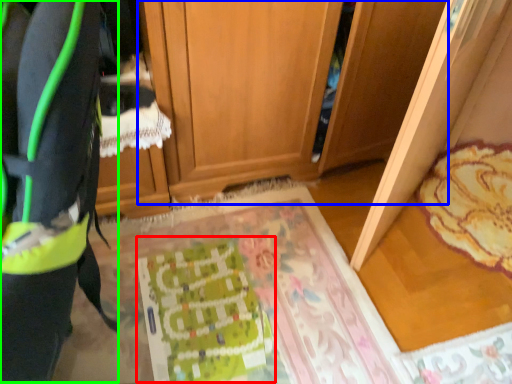
Question: Which object is positioned farthest from wrapping paper (highlighted by a red box)? Select from cabinetry (highlighted by a blue box) and wide (highlighted by a green box).

Choices:
 (A) cabinetry
 (B) wide

Answer: (B)